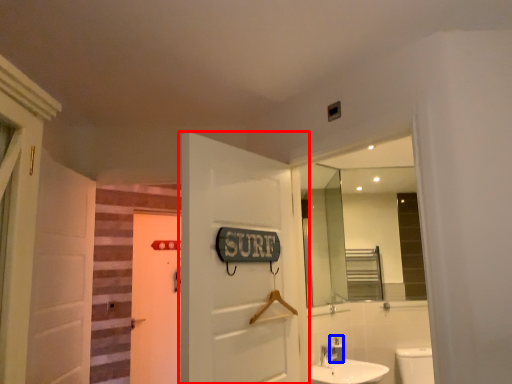
Question: Which point is further to the camera, door (highlighted by a red box) or toiletry (highlighted by a blue box)?

Choices:
 (A) door
 (B) toiletry

Answer: (B)